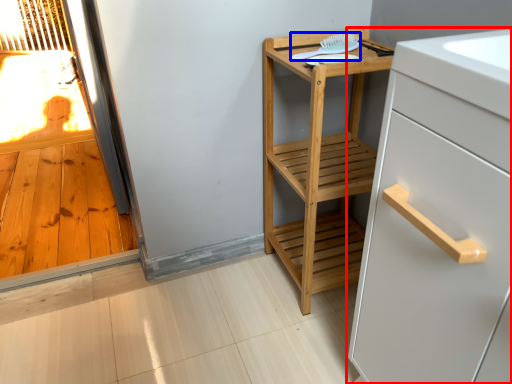
Question: Which object appears farthest to the camera in this image, cabinetry (highlighted by a red box) or brush (highlighted by a blue box)?

Choices:
 (A) cabinetry
 (B) brush

Answer: (B)